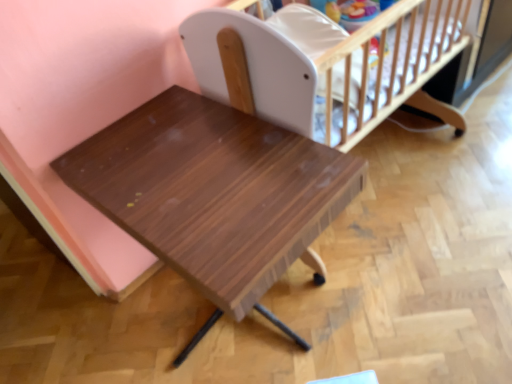
You are a GUI agent. You are given a task and a screenshot of the screen. Output one action in this format:
    pyautogui.click(x=<x>, y=<y>)
    Task: Click on the free space underneath wooden table at center (from a real-world perspective)
    The height and width of the screenshot is (384, 512).
    Given the screenshot: What is the action you would take?
    pyautogui.click(x=229, y=322)